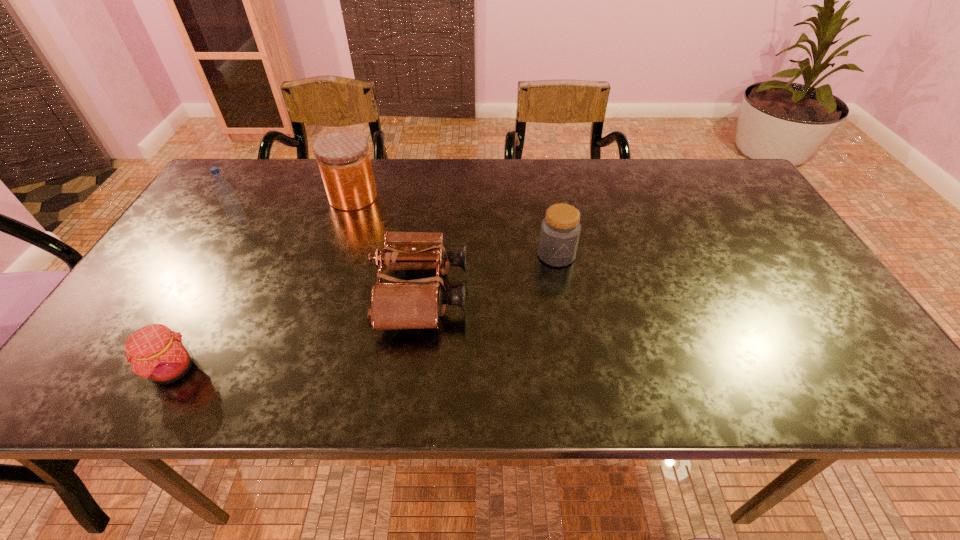
Locate an element on the screen. vacant space at the left edge of the desktop is located at coordinates (212, 207).

I want to click on vacant space at the far left corner of the desktop, so click(x=272, y=160).

Where is `vacant space at the near left corner of the desktop`? This screenshot has width=960, height=540. vacant space at the near left corner of the desktop is located at coordinates (113, 376).

Find the location of a particular element. vacant area at the far right corner of the desktop is located at coordinates pos(733,191).

The image size is (960, 540). In order to click on empty space that is in between the shortest object and the left jar in this screenshot , I will do `click(263, 283)`.

Image resolution: width=960 pixels, height=540 pixels. Identify the location of vacant space that is in between the taller jar and the nearest object. (263, 283).

Image resolution: width=960 pixels, height=540 pixels. What are the coordinates of `free space between the binoculars and the nearer jar` in the screenshot? It's located at (490, 274).

Where is `free point between the left jar and the right jar`? Image resolution: width=960 pixels, height=540 pixels. free point between the left jar and the right jar is located at coordinates point(455,226).

This screenshot has height=540, width=960. What are the coordinates of `free area in between the nearest object and the binoculars` in the screenshot? It's located at [298, 331].

Identify the location of free space between the jam and the shorter jar. Image resolution: width=960 pixels, height=540 pixels. (365, 312).